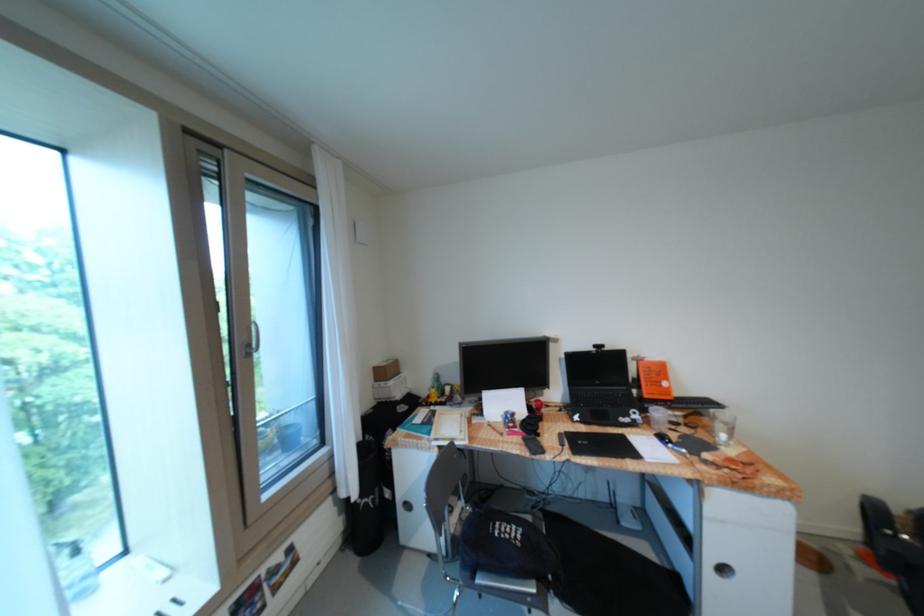
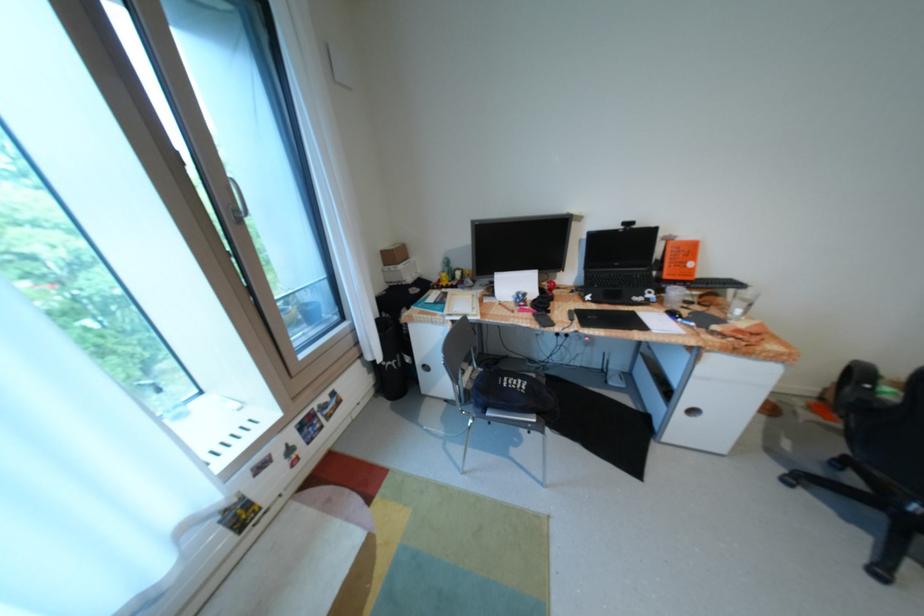
The point at (260, 346) is marked in the first image. Where is the corresponding point in the second image?

(247, 211)